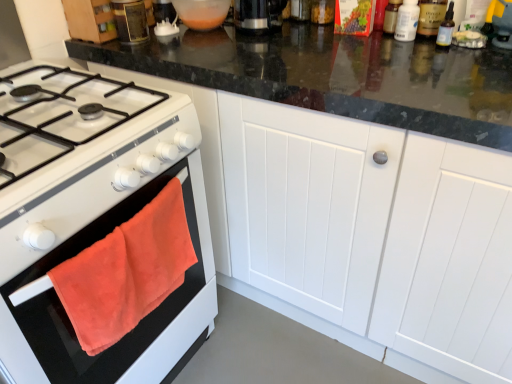
What do you see at coordinates (258, 15) in the screenshot?
I see `black plastic coffee machine at upper center` at bounding box center [258, 15].

The height and width of the screenshot is (384, 512). Describe the element at coordinates (126, 272) in the screenshot. I see `orange plush towel at left` at that location.

The height and width of the screenshot is (384, 512). Describe the element at coordinates (130, 21) in the screenshot. I see `metallic canister at upper left` at that location.

You are a GUI agent. You are given a task and a screenshot of the screen. Output one action in this format:
    pyautogui.click(x=<x>, y=<y>)
    Task: Click on the metallic canister at upper left
    The height and width of the screenshot is (384, 512).
    Given the screenshot: What is the action you would take?
    pyautogui.click(x=130, y=21)

Describe the element at coordinates (93, 216) in the screenshot. This screenshot has height=384, width=512. I see `white matte gas stove at left` at that location.

What do you see at coordinates (391, 16) in the screenshot? This screenshot has height=384, width=512. I see `transparent plastic bottle at upper right, arranged as the fourth bottle when viewed from the right` at bounding box center [391, 16].

Where is `clear glass bottle at upper right, positioned as the fourth bottle in left-to-right order`? clear glass bottle at upper right, positioned as the fourth bottle in left-to-right order is located at coordinates (446, 28).

What do you see at coordinates (446, 28) in the screenshot?
I see `clear glass bottle at upper right, positioned as the fourth bottle in left-to-right order` at bounding box center [446, 28].

You are a GUI agent. You are given a task and a screenshot of the screen. Output one action in this format:
    pyautogui.click(x=<x>, y=<y>)
    Task: Click on the black plastic coffee machine at upper center
    
    Given the screenshot: What is the action you would take?
    pyautogui.click(x=258, y=15)

Is transparent plastic bottle at upper right, arranged as the fourth bottle when viewed from the right, facing towards white matte cabinet at center?

No.

How distant is transparent plastic bottle at upper right, positioned as the first bottle in left-to-right order, from white matte cabinet at center?

A distance of 26.76 inches exists between transparent plastic bottle at upper right, positioned as the first bottle in left-to-right order, and white matte cabinet at center.

How many degrees apart are the facing directions of transparent plastic bottle at upper right, positioned as the first bottle in left-to-right order, and white matte cabinet at center?

0.00219 degrees.

You are a GUI agent. You are given a task and a screenshot of the screen. Output one action in this format:
    pyautogui.click(x=<x>, y=<y>)
    Task: Click on the cabinetry on the left side of transparent plastic bottle at upper right, arranged as the fourth bottle when viewed from the right
    The image size is (512, 384).
    Given the screenshot: What is the action you would take?
    pyautogui.click(x=360, y=228)

In terms of size, does translucent plastic container at upper center appear bigger or smaller than white matte gas stove at left?

translucent plastic container at upper center is smaller than white matte gas stove at left.

From the image's perspective, relative to white matte gas stove at left, is translucent plastic container at upper center above or below?

translucent plastic container at upper center is above white matte gas stove at left.

Is translucent plastic container at upper center facing towards white matte gas stove at left?

No, translucent plastic container at upper center does not turn towards white matte gas stove at left.

Is translucent plastic container at upper center inside the boundaries of white matte gas stove at left, or outside?

translucent plastic container at upper center is not inside white matte gas stove at left, it's outside.

Do you think transparent plastic bottle at upper right, positioned as the first bottle in left-to-right order, is within translucent plastic container at upper center, or outside of it?

The correct answer is: outside.

From the image's perspective, which one is positioned higher, transparent plastic bottle at upper right, positioned as the first bottle in left-to-right order, or translucent plastic container at upper center?

translucent plastic container at upper center.

Is transparent plastic bottle at upper right, arranged as the fourth bottle when viewed from the right, positioned with its back to translucent plastic container at upper center?

transparent plastic bottle at upper right, arranged as the fourth bottle when viewed from the right, does not have its back to translucent plastic container at upper center.

Can you confirm if metallic canister at upper left is bigger than white matte gas stove at left?

No, metallic canister at upper left is not bigger than white matte gas stove at left.

Is white matte gas stove at left inside metallic canister at upper left?

No.

Which is more to the left, metallic canister at upper left or white matte gas stove at left?

From the viewer's perspective, white matte gas stove at left appears more on the left side.

You are a GUI agent. You are given a task and a screenshot of the screen. Output one action in this format:
    pyautogui.click(x=<x>, y=<y>)
    Task: Click on the kitchen appliance lying behind the white matte gas stove at left
    
    Given the screenshot: What is the action you would take?
    pyautogui.click(x=130, y=21)

Starting from the black plastic coffee machine at upper center, which bottle is the 1st one in front? Please provide its 2D coordinates.

[(391, 16)]

From the picture: Is transparent plastic bottle at upper right, arranged as the fourth bottle when viewed from the right, not within black plastic coffee machine at upper center?

Yes, transparent plastic bottle at upper right, arranged as the fourth bottle when viewed from the right, is located beyond the bounds of black plastic coffee machine at upper center.

Is transparent plastic bottle at upper right, arranged as the fourth bottle when viewed from the right, looking in the opposite direction of black plastic coffee machine at upper center?

No, transparent plastic bottle at upper right, arranged as the fourth bottle when viewed from the right, is not facing away from black plastic coffee machine at upper center.

Looking at this image, from the image's perspective, between transparent plastic bottle at upper right, positioned as the first bottle in left-to-right order, and black plastic coffee machine at upper center, which one is located above?

black plastic coffee machine at upper center, from the image's perspective.

Is white matte cabinet at center positioned behind white plastic bottle at upper right, the third bottle in the right-to-left sequence?

No.

From a real-world perspective, is white matte cabinet at center on top of white plastic bottle at upper right, the 2th bottle positioned from the left?

Actually, white matte cabinet at center is physically below white plastic bottle at upper right, the 2th bottle positioned from the left, in the real world.

Is white matte cabinet at center facing towards white plastic bottle at upper right, the 2th bottle positioned from the left?

No, white matte cabinet at center is not facing towards white plastic bottle at upper right, the 2th bottle positioned from the left.

At what (x,y) coordinates should I click in order to perform the action: click on the 1st bottle positioned above the white matte cabinet at center (from a real-world perspective). Please return your answer as a coordinate pair (x, y). The height and width of the screenshot is (384, 512). Looking at the image, I should click on (407, 21).

How many degrees apart are the facing directions of clear glass bottle at upper right, which is counted as the 1th bottle, starting from the right, and metallic canister at upper left?

The angle between the facing direction of clear glass bottle at upper right, which is counted as the 1th bottle, starting from the right, and the facing direction of metallic canister at upper left is 0.0048 degrees.

Which of these two, clear glass bottle at upper right, positioned as the fourth bottle in left-to-right order, or metallic canister at upper left, is bigger?

metallic canister at upper left.

Relative to metallic canister at upper left, is clear glass bottle at upper right, which is counted as the 1th bottle, starting from the right, in front or behind?

Visually, clear glass bottle at upper right, which is counted as the 1th bottle, starting from the right, is located in front of metallic canister at upper left.

Is point (441, 31) less distant than point (124, 43)?

Yes, it is in front of point (124, 43).

The width and height of the screenshot is (512, 384). I want to click on cabinetry below the transparent plastic bottle at upper right, arranged as the fourth bottle when viewed from the right (from the image's perspective), so (360, 228).

This screenshot has width=512, height=384. Identify the location of gas stove on the left of translucent plastic container at upper center. (93, 216).

Which object lies further to the anchor point transparent plastic bottle at upper right, arranged as the fourth bottle when viewed from the right, translucent plastic container at upper center or white matte gas stove at left?

white matte gas stove at left.

Looking at the image, which one is located further to orange plush towel at left, metallic canister at upper left or white plastic bottle at upper right, the third bottle in the right-to-left sequence?

white plastic bottle at upper right, the third bottle in the right-to-left sequence, is positioned further to the anchor orange plush towel at left.

Based on their spatial positions, is translucent plastic container at upper center or metallic canister at upper left closer to black plastic coffee machine at upper center?

translucent plastic container at upper center.

When comparing their distances from transparent plastic bottle at upper right, positioned as the first bottle in left-to-right order, does translucent plastic container at upper center or orange plush towel at left seem closer?

translucent plastic container at upper center is closer to transparent plastic bottle at upper right, positioned as the first bottle in left-to-right order.

Based on their spatial positions, is clear glass bottle at upper right, which is counted as the 1th bottle, starting from the right, or orange plush towel at left further from white matte cabinet at center?

clear glass bottle at upper right, which is counted as the 1th bottle, starting from the right.

From the picture: From the image, which object appears to be farther from metallic canister at upper left, white matte gas stove at left or black plastic coffee machine at upper center?

white matte gas stove at left is further to metallic canister at upper left.

Based on their spatial positions, is translucent plastic container at upper center or clear glass bottle at upper right, which is counted as the 1th bottle, starting from the right, further from white plastic bottle at upper right, the third bottle in the right-to-left sequence?

translucent plastic container at upper center is further to white plastic bottle at upper right, the third bottle in the right-to-left sequence.

Based on their spatial positions, is translucent plastic container at upper center or orange plush towel at left further from clear glass bottle at upper right, positioned as the fourth bottle in left-to-right order?

orange plush towel at left.

The height and width of the screenshot is (384, 512). In order to click on appliance between metallic canister at upper left and transparent plastic bottle at upper right, positioned as the first bottle in left-to-right order in this screenshot , I will do `click(202, 13)`.

The width and height of the screenshot is (512, 384). In order to click on coffee machine situated between metallic canister at upper left and white plastic bottle at upper right, the third bottle in the right-to-left sequence, from left to right in this screenshot , I will do `click(258, 15)`.

Image resolution: width=512 pixels, height=384 pixels. I want to click on cabinetry between metallic canister at upper left and orange plush towel at left vertically, so click(x=360, y=228).

The height and width of the screenshot is (384, 512). I want to click on cabinetry between black plastic coffee machine at upper center and white matte gas stove at left from top to bottom, so click(360, 228).